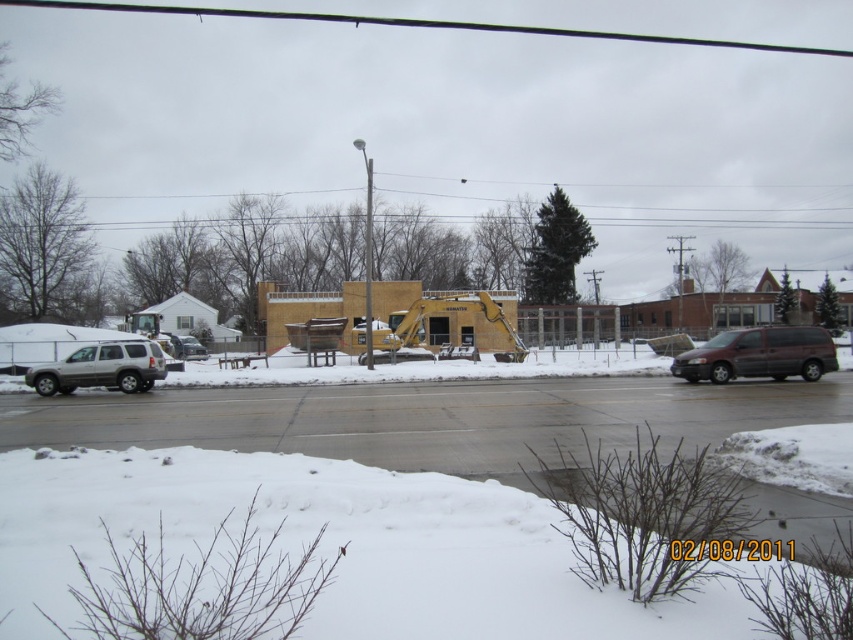
Is white fluffy snow at lower center further to camera compared to dark gray matte van at right?

That is False.

Which is in front, point (323, 595) or point (763, 355)?

Point (323, 595) is in front.

This screenshot has width=853, height=640. What are the coordinates of `white fluffy snow at lower center` in the screenshot? It's located at (335, 545).

Does dark gray matte van at right lie behind silver metallic suv at left?

That is False.

Between point (787, 358) and point (102, 372), which one is positioned behind?

Point (102, 372)

This screenshot has width=853, height=640. What are the coordinates of `dark gray matte van at right` in the screenshot? It's located at (759, 355).

Can you confirm if white fluffy snow at lower center is smaller than silver metallic suv at left?

Indeed, white fluffy snow at lower center has a smaller size compared to silver metallic suv at left.

In the scene shown: Between white fluffy snow at lower center and silver metallic suv at left, which one appears on the right side from the viewer's perspective?

Positioned to the right is white fluffy snow at lower center.

Is point (462, 563) closer to camera compared to point (103, 348)?

Yes, point (462, 563) is closer to viewer.

Where is `white fluffy snow at lower center`? This screenshot has width=853, height=640. white fluffy snow at lower center is located at coordinates (335, 545).